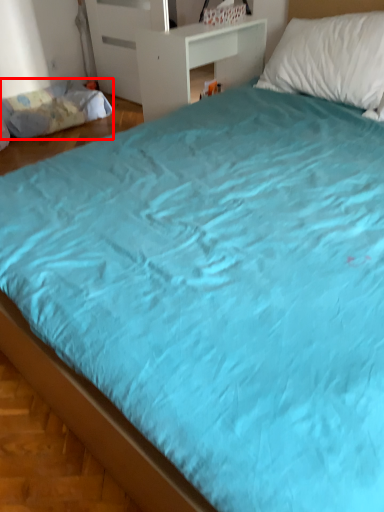
Question: Observing the image, what is the correct spatial positioning of mattress (annotated by the red box) in reference to table?

Choices:
 (A) left
 (B) right

Answer: (A)